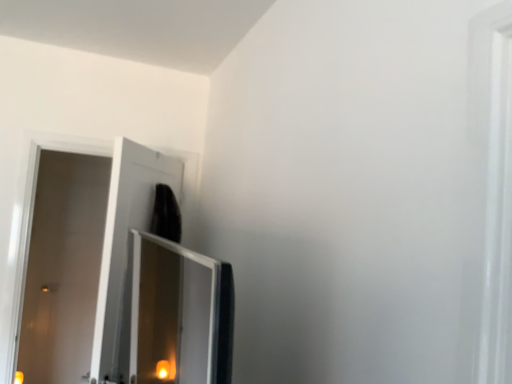
Image resolution: width=512 pixels, height=384 pixels. What are the coordinates of `transparent glass screen door at upper left` in the screenshot? It's located at tap(125, 249).

The height and width of the screenshot is (384, 512). What do you see at coordinates (125, 249) in the screenshot? I see `transparent glass screen door at upper left` at bounding box center [125, 249].

In order to face transparent glass screen door at upper left, should I rotate leftwards or rightwards?

To align with it, rotate left about 14.148°.

The height and width of the screenshot is (384, 512). Describe the element at coordinates (61, 267) in the screenshot. I see `white glossy door at left` at that location.

Where is `white glossy door at left`? The width and height of the screenshot is (512, 384). white glossy door at left is located at coordinates (61, 267).

What is the approximate width of white glossy door at left?

13.02 centimeters.

Image resolution: width=512 pixels, height=384 pixels. I want to click on transparent glass screen door at upper left, so click(125, 249).

Based on the photo, can you confirm if transparent glass screen door at upper left is positioned to the left of white glossy door at left?

In fact, transparent glass screen door at upper left is to the right of white glossy door at left.

Considering their positions, is transparent glass screen door at upper left located in front of or behind white glossy door at left?

Clearly, transparent glass screen door at upper left is in front of white glossy door at left.

Is point (170, 174) positioned behind point (68, 327)?

No, (170, 174) is closer to viewer.

From the image's perspective, is transparent glass screen door at upper left below white glossy door at left?

Yes, from the image's perspective, transparent glass screen door at upper left is beneath white glossy door at left.

From a real-world perspective, is transparent glass screen door at upper left physically located above or below white glossy door at left?

In terms of real-world spatial position, transparent glass screen door at upper left is above white glossy door at left.

Does transparent glass screen door at upper left have a lesser width compared to white glossy door at left?

No.

Who is taller, transparent glass screen door at upper left or white glossy door at left?

white glossy door at left.

Considering the relative sizes of transparent glass screen door at upper left and white glossy door at left in the image provided, is transparent glass screen door at upper left bigger than white glossy door at left?

Indeed, transparent glass screen door at upper left has a larger size compared to white glossy door at left.

Which is correct: transparent glass screen door at upper left is inside white glossy door at left, or outside of it?

transparent glass screen door at upper left is not enclosed by white glossy door at left.

Is transparent glass screen door at upper left not near white glossy door at left?

That's right, there is a large distance between transparent glass screen door at upper left and white glossy door at left.

Could you tell me if transparent glass screen door at upper left is facing white glossy door at left?

Yes.

What's the angular difference between transparent glass screen door at upper left and white glossy door at left's facing directions?

They differ by 118 degrees in their facing directions.

Where is `door that appears on the left of transparent glass screen door at upper left`? door that appears on the left of transparent glass screen door at upper left is located at coordinates (61, 267).

Can you confirm if white glossy door at left is positioned to the right of transparent glass screen door at upper left?

Incorrect, white glossy door at left is not on the right side of transparent glass screen door at upper left.

Between white glossy door at left and transparent glass screen door at upper left, which one is positioned behind?

white glossy door at left.

Is point (82, 331) closer or farther from the camera than point (102, 253)?

Point (82, 331).

From the image's perspective, is white glossy door at left over transparent glass screen door at upper left?

Correct, white glossy door at left appears higher than transparent glass screen door at upper left in the image.

From a real-world perspective, is white glossy door at left physically above transparent glass screen door at upper left?

No.

Looking at this image, between white glossy door at left and transparent glass screen door at upper left, which one has larger width?

Wider between the two is transparent glass screen door at upper left.

Considering the relative sizes of white glossy door at left and transparent glass screen door at upper left in the image provided, is white glossy door at left taller than transparent glass screen door at upper left?

Yes, white glossy door at left is taller than transparent glass screen door at upper left.

Between white glossy door at left and transparent glass screen door at upper left, which one has smaller size?

white glossy door at left.

Does white glossy door at left contain transparent glass screen door at upper left?

No, transparent glass screen door at upper left is located outside of white glossy door at left.

Looking at this image, is white glossy door at left directly adjacent to transparent glass screen door at upper left?

white glossy door at left and transparent glass screen door at upper left are clearly separated.

Is white glossy door at left turned away from transparent glass screen door at upper left?

No, white glossy door at left is not facing the opposite direction of transparent glass screen door at upper left.

Can you tell me how much white glossy door at left and transparent glass screen door at upper left differ in facing direction?

118 degrees separate the facing orientations of white glossy door at left and transparent glass screen door at upper left.

This screenshot has width=512, height=384. Identify the location of door on the left side of transparent glass screen door at upper left. (61, 267).

This screenshot has height=384, width=512. In order to click on door behind the transparent glass screen door at upper left in this screenshot , I will do `click(61, 267)`.

Identify the location of screen door located on the right of white glossy door at left. The height and width of the screenshot is (384, 512). (125, 249).